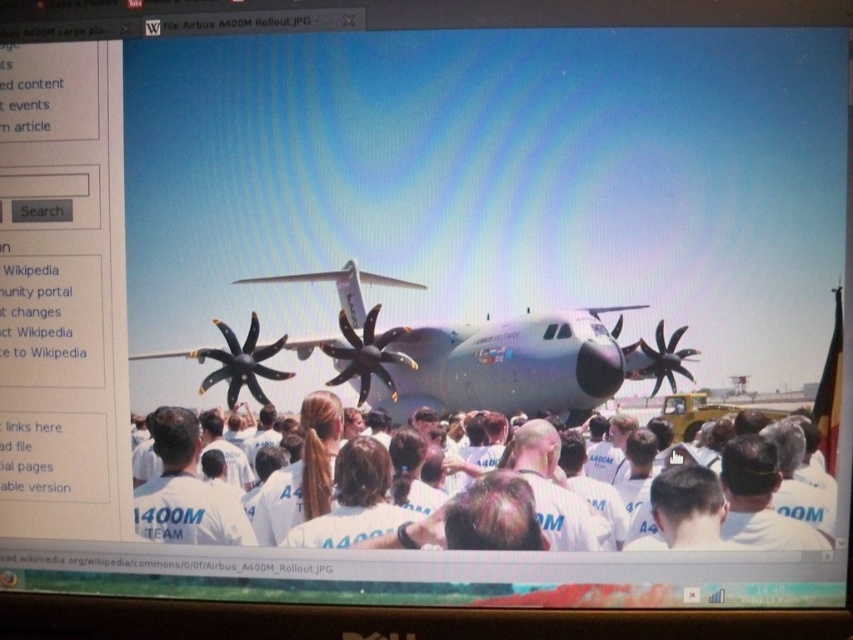
Question: Considering the relative positions of silver metallic airplane at center and white cotton shirts at center in the image provided, where is silver metallic airplane at center located with respect to white cotton shirts at center?

Choices:
 (A) left
 (B) right

Answer: (A)

Question: Which point appears farthest from the camera in this image?

Choices:
 (A) (479, 337)
 (B) (163, 426)

Answer: (B)

Question: Which point is closer to the camera?

Choices:
 (A) white cotton shirt at center
 (B) silver metallic airplane at center

Answer: (B)

Question: Is silver metallic airplane at center to the right of white cotton shirt at center from the viewer's perspective?

Choices:
 (A) no
 (B) yes

Answer: (B)

Question: Which object is farther from the camera taking this photo?

Choices:
 (A) white cotton shirt at center
 (B) silver metallic airplane at center

Answer: (A)

Question: Does silver metallic airplane at center come in front of white cotton shirts at center?

Choices:
 (A) yes
 (B) no

Answer: (B)